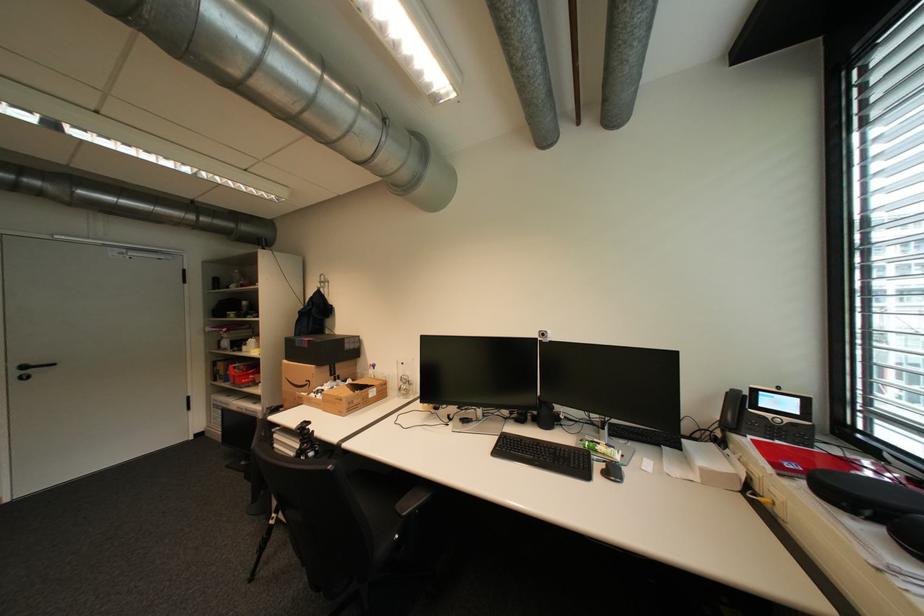
Locate an element on the screen. The height and width of the screenshot is (616, 924). black phone handset is located at coordinates point(769,415).